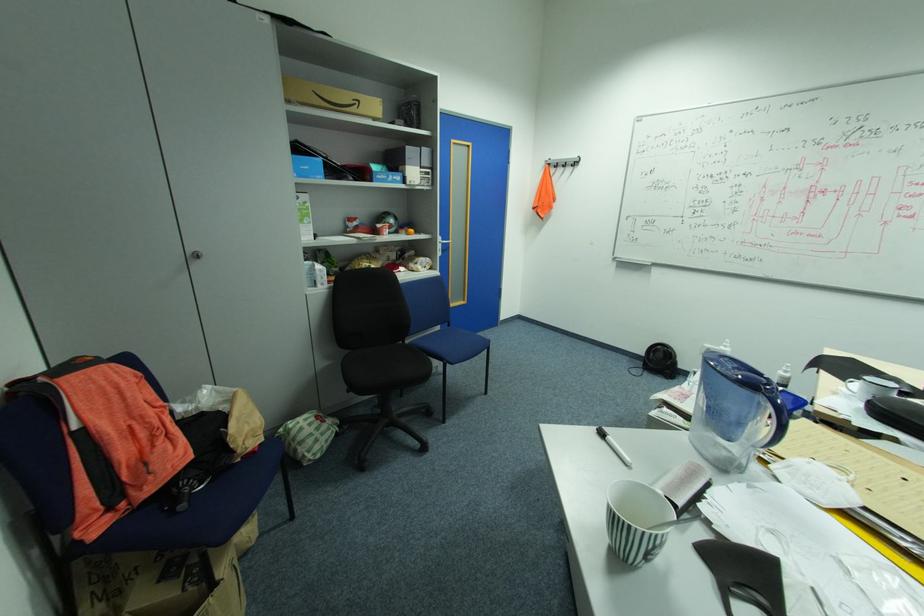
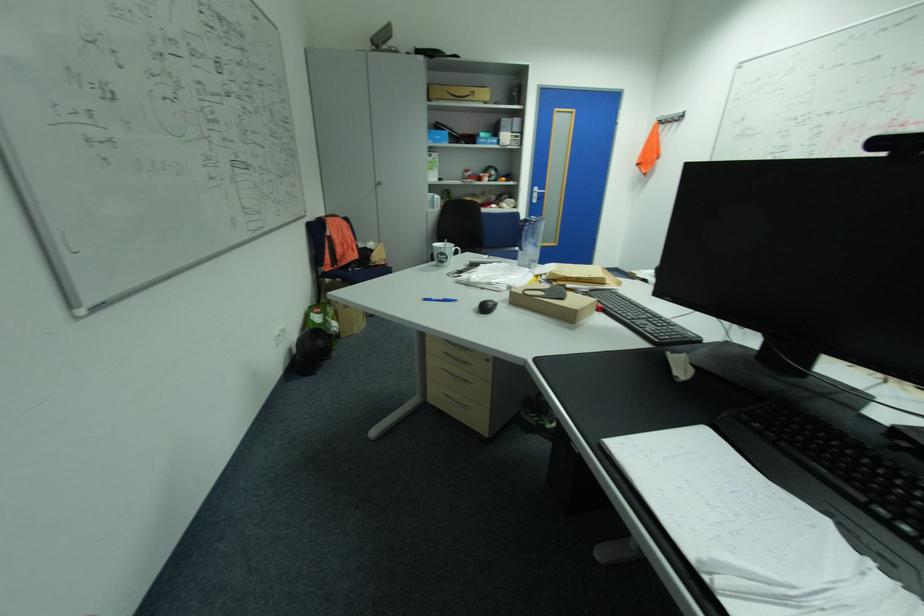
In the second image, find the point that corresponds to point 450,244 in the first image.

(544, 193)